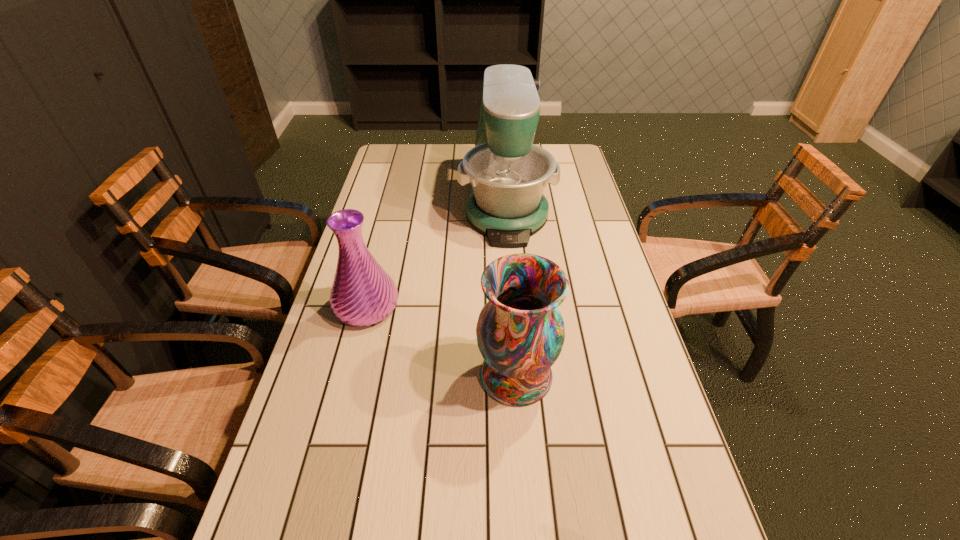
I want to click on the farthest object, so click(x=507, y=173).

This screenshot has width=960, height=540. In order to click on mixer in this screenshot , I will do `click(507, 173)`.

Identify the location of the right vase. (520, 333).

The height and width of the screenshot is (540, 960). Find the location of `the nearest object`. the nearest object is located at coordinates (520, 333).

Find the location of a particular element. the farther vase is located at coordinates (362, 294).

Where is `the left vase`? the left vase is located at coordinates (362, 294).

Locate an element on the screen. free space located on the front-facing side of the mixer is located at coordinates (514, 301).

What are the coordinates of `free space located on the right of the nearest object` in the screenshot? It's located at [x=581, y=375].

I want to click on vacant space located on the right of the second farthest object, so click(472, 307).

The height and width of the screenshot is (540, 960). Find the location of `object that is at the far edge`. object that is at the far edge is located at coordinates (507, 173).